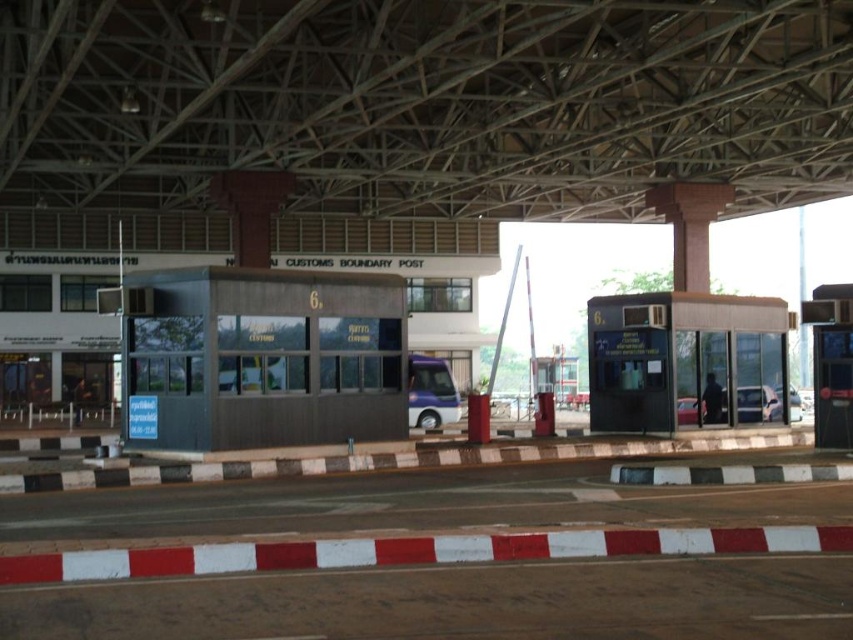
Question: Which object is positioned closest to the metallic gray booth at center?

Choices:
 (A) metallic purple bus at center
 (B) matte black booth at right

Answer: (A)

Question: Observing the image, what is the correct spatial positioning of matte black booth at right in reference to metallic purple bus at center?

Choices:
 (A) right
 (B) left

Answer: (A)

Question: Does matte black booth at right appear on the right side of metallic purple bus at center?

Choices:
 (A) yes
 (B) no

Answer: (A)

Question: Among these points, which one is farthest from the camera?

Choices:
 (A) (227, 300)
 (B) (416, 422)

Answer: (B)

Question: Is matte black booth at right smaller than metallic purple bus at center?

Choices:
 (A) no
 (B) yes

Answer: (A)

Question: Which is nearer to the dark gray concrete bus station at center?

Choices:
 (A) matte black booth at right
 (B) metallic gray booth at center
 (C) metallic purple bus at center

Answer: (A)